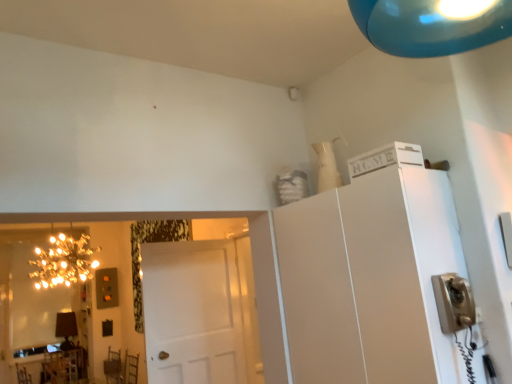
Measure the distance between point (238, 246) and camera.

Point (238, 246) and camera are 3.90 meters apart from each other.

At what (x,y) coordinates should I click in order to perform the action: click on wooden table at lower left. Please return your answer as a coordinate pair (x, y). Image resolution: width=512 pixels, height=384 pixels. Looking at the image, I should click on (65, 366).

Describe the element at coordinates (64, 261) in the screenshot. I see `illuminated string lights at left` at that location.

I want to click on gold reflective mirror at left, so click(27, 295).

Choose the correct answer: Is gold reflective mirror at left inside matte black lamp at lower left or outside it?

gold reflective mirror at left is located beyond the bounds of matte black lamp at lower left.

Based on the photo, is gold reflective mirror at left shorter than matte black lamp at lower left?

In fact, gold reflective mirror at left may be taller than matte black lamp at lower left.

Is gold reflective mirror at left wider than matte black lamp at lower left?

In fact, gold reflective mirror at left might be narrower than matte black lamp at lower left.

From the image's perspective, which one is positioned lower, gold reflective mirror at left or matte black lamp at lower left?

matte black lamp at lower left is shown below in the image.

Could you tell me if white matte cabinet at upper right is facing gold reflective mirror at left?

No, white matte cabinet at upper right is not oriented towards gold reflective mirror at left.

From the image's perspective, who appears lower, white matte cabinet at upper right or gold reflective mirror at left?

gold reflective mirror at left, from the image's perspective.

Is white matte cabinet at upper right wider or thinner than gold reflective mirror at left?

In the image, white matte cabinet at upper right appears to be wider than gold reflective mirror at left.

Where is `cabinetry lying on the right of gold reflective mirror at left`? Image resolution: width=512 pixels, height=384 pixels. cabinetry lying on the right of gold reflective mirror at left is located at coordinates (370, 280).

Which of these two, white matte door at center or illuminated string lights at left, is smaller?

With smaller size is white matte door at center.

Which is behind, point (149, 381) or point (77, 272)?

The point (77, 272) is behind.

Which is more to the left, white matte door at center or illuminated string lights at left?

From the viewer's perspective, illuminated string lights at left appears more on the left side.

Could you tell me if white matte door at center is turned towards illuminated string lights at left?

No, white matte door at center is not facing towards illuminated string lights at left.

Which is in front, white matte door at center or wooden table at lower left?

white matte door at center.

Is white matte door at center turned away from wooden table at lower left?

Yes, white matte door at center is facing away from wooden table at lower left.

Can you confirm if white matte door at center is shorter than wooden table at lower left?

In fact, white matte door at center may be taller than wooden table at lower left.

From the picture: From a real-world perspective, who is located lower, white matte door at center or wooden table at lower left?

wooden table at lower left.

This screenshot has height=384, width=512. Find the location of `lamp that is above the wooden table at lower left (from the image's perspective)`. lamp that is above the wooden table at lower left (from the image's perspective) is located at coordinates (66, 329).

Is wooden table at lower left aimed at matte black lamp at lower left?

No, wooden table at lower left does not turn towards matte black lamp at lower left.

Considering the sizes of objects wooden table at lower left and matte black lamp at lower left in the image provided, who is shorter, wooden table at lower left or matte black lamp at lower left?

wooden table at lower left is shorter.

Which is correct: wooden table at lower left is inside matte black lamp at lower left, or outside of it?

wooden table at lower left is not enclosed by matte black lamp at lower left.

The width and height of the screenshot is (512, 384). Identify the location of door above the matte black lamp at lower left (from the image's perspective). (200, 312).

From the image's perspective, which object appears higher, matte black lamp at lower left or white matte door at center?

white matte door at center, from the image's perspective.

Which object is further away from the camera taking this photo, matte black lamp at lower left or white matte door at center?

matte black lamp at lower left is behind.

Considering the relative sizes of matte black lamp at lower left and white matte door at center in the image provided, is matte black lamp at lower left shorter than white matte door at center?

Yes.

From the picture: Who is shorter, matte black lamp at lower left or gold reflective mirror at left?

With less height is matte black lamp at lower left.

Is matte black lamp at lower left smaller than gold reflective mirror at left?

Correct, matte black lamp at lower left occupies less space than gold reflective mirror at left.

Does matte black lamp at lower left turn towards gold reflective mirror at left?

No, matte black lamp at lower left is not oriented towards gold reflective mirror at left.

In the scene shown: Is matte black lamp at lower left at the right side of gold reflective mirror at left?

Correct, you'll find matte black lamp at lower left to the right of gold reflective mirror at left.

Find the location of `mirror in front of the matte black lamp at lower left`. mirror in front of the matte black lamp at lower left is located at coordinates (27, 295).

This screenshot has width=512, height=384. Identify the location of mirror below the white matte cabinet at upper right (from the image's perspective). (27, 295).

Estimate the real-world distances between objects in this image. Which object is closer to gold reflective mirror at left, wooden table at lower left or white matte cabinet at upper right?

wooden table at lower left is positioned closer to the anchor gold reflective mirror at left.

When comparing their distances from white matte door at center, does wooden table at lower left or illuminated string lights at left seem closer?

illuminated string lights at left lies closer to white matte door at center than the other object.

From the image, which object appears to be nearer to wooden table at lower left, gold reflective mirror at left or white matte cabinet at upper right?

gold reflective mirror at left is closer to wooden table at lower left.

From the image, which object appears to be nearer to white matte door at center, illuminated string lights at left or gold reflective mirror at left?

illuminated string lights at left.

Looking at the image, which one is located further to gold reflective mirror at left, wooden table at lower left or white matte door at center?

white matte door at center is positioned further to the anchor gold reflective mirror at left.

Which object lies nearer to the anchor point matte black lamp at lower left, white matte cabinet at upper right or wooden table at lower left?

wooden table at lower left.

From the image, which object appears to be nearer to gold reflective mirror at left, wooden table at lower left or illuminated string lights at left?

illuminated string lights at left.

Based on their spatial positions, is wooden table at lower left or illuminated string lights at left further from matte black lamp at lower left?

illuminated string lights at left.

Where is `light fixture between white matte cabinet at upper right and matte black lamp at lower left in the front-back direction`? This screenshot has width=512, height=384. light fixture between white matte cabinet at upper right and matte black lamp at lower left in the front-back direction is located at coordinates (64, 261).

Locate an element on the screen. light fixture between white matte door at center and matte black lamp at lower left from front to back is located at coordinates (64, 261).

This screenshot has width=512, height=384. What are the coordinates of `lamp between gold reflective mirror at left and wooden table at lower left from top to bottom` in the screenshot? It's located at (66, 329).

I want to click on mirror between white matte door at center and matte black lamp at lower left from front to back, so click(27, 295).